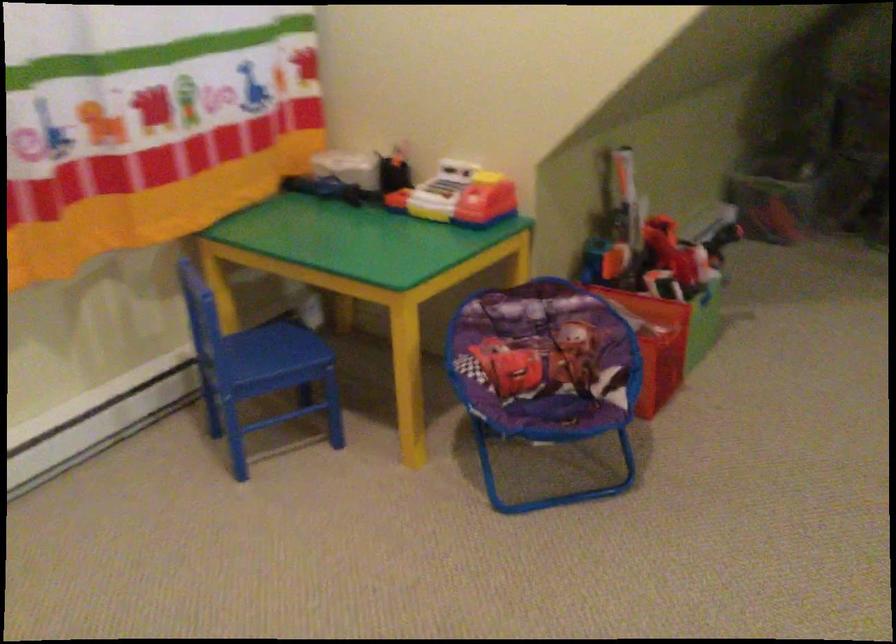
Identify the location of blue chair sitting surface. (274, 348).